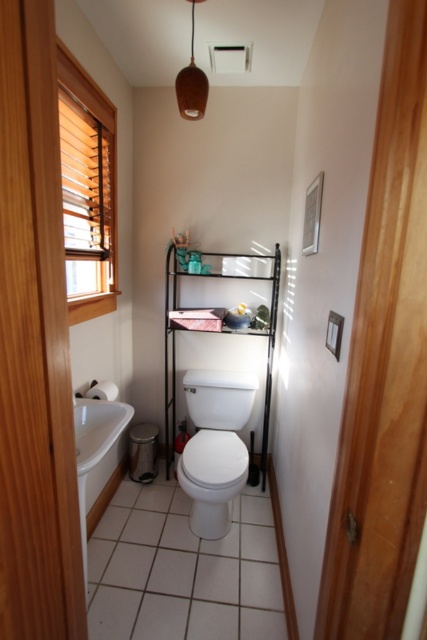
You are planning to replace the white glossy sink at lower left and the white glossy toilet at center with new ones. If the new sink has the same width as the current toilet, will it fit in the space where the old sink is located?

The white glossy toilet at center is wider than the white glossy sink at lower left. If the new sink has the same width as the current toilet, it will not fit in the space where the old sink is located because it is wider.

You are a cleaning robot with a circular base that has a diameter of 0.5 meters. You need to clean around the white glossy toilet at center. Given your position at point A, which is 0.3 meters away from the toilet, can you maneuver around it without hitting any walls or obstacles?

The white glossy toilet at center is located at point (215, 445). Since the robot has a diameter of 0.5 meters and is positioned 0.3 meters away from the toilet, the distance between the robot and the toilet is less than the robot radius plus the toilet radius. Therefore, the robot cannot safely maneuver around the toilet without collision.

You are a cleaning robot with a width of 24 inches. You are positioned near the white glossy sink at lower left and want to move to the white glossy toilet at center. Can you navigate the space between them without touching either fixture?

The distance between the white glossy toilet at center and the white glossy sink at lower left is 26.89 inches. Since the robot is 24 inches wide, there is enough space to navigate between them without touching either fixture.